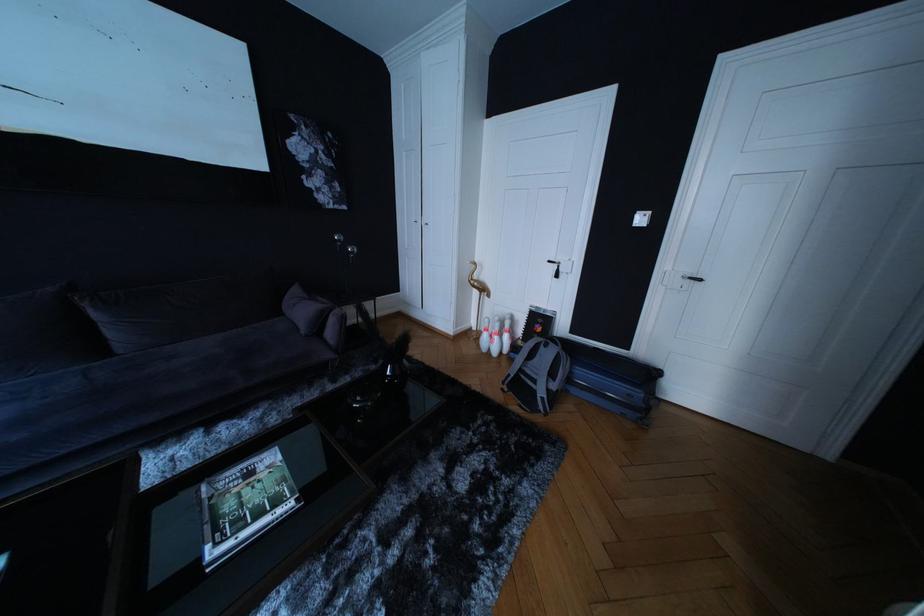
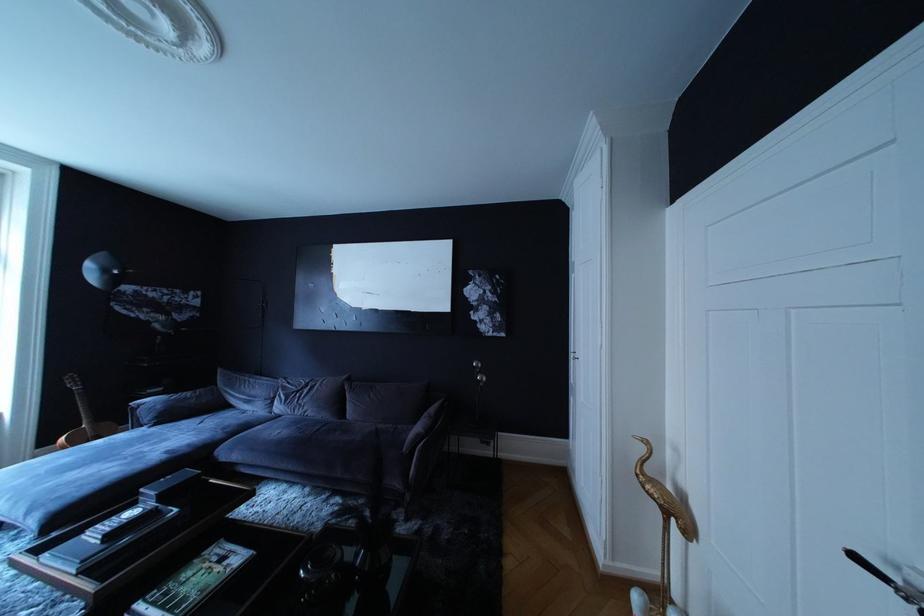
Where in the second image is the point corresponding to (259,480) from the first image?

(232, 565)